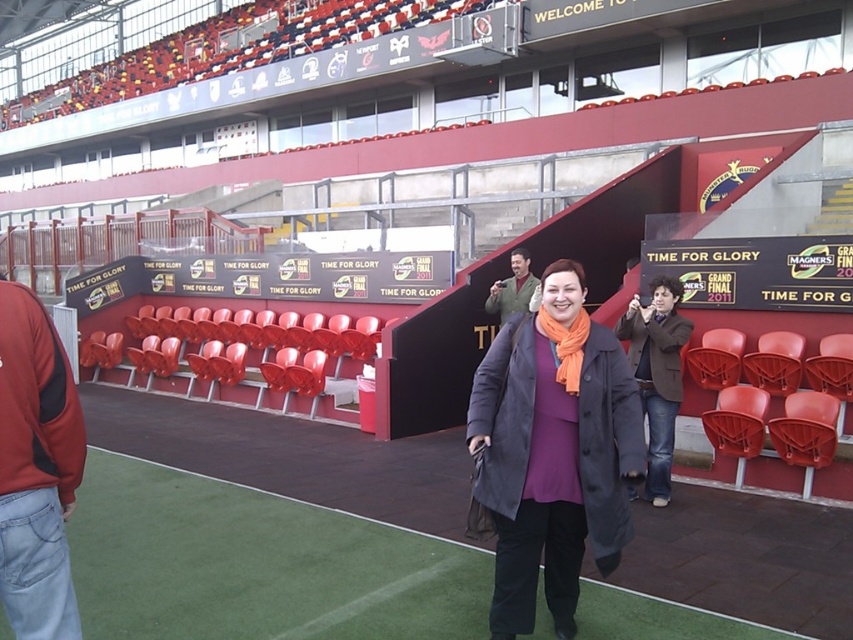
Is matte purple sweater at center to the right of green fuzzy jacket at center from the viewer's perspective?

No, matte purple sweater at center is not to the right of green fuzzy jacket at center.

This screenshot has height=640, width=853. What do you see at coordinates (553, 451) in the screenshot?
I see `matte purple sweater at center` at bounding box center [553, 451].

Who is more forward, (569, 536) or (512, 284)?

Point (569, 536)

Find the location of a particular element. Image resolution: width=853 pixels, height=640 pixels. matte purple sweater at center is located at coordinates (553, 451).

What do you see at coordinates (566, 346) in the screenshot?
I see `orange fabric scarf at center` at bounding box center [566, 346].

Does point (584, 310) lie behind point (521, 305)?

That is False.

Is point (578, 385) farther from camera compared to point (529, 298)?

No, it is not.

Find the location of a particular element. This screenshot has width=853, height=640. orange fabric scarf at center is located at coordinates (566, 346).

Is point (646, 337) in front of point (570, 385)?

No, (646, 337) is further to viewer.

Is brown leather jacket at center above orange fabric scarf at center?

No, brown leather jacket at center is not above orange fabric scarf at center.

The image size is (853, 640). In order to click on brown leather jacket at center in this screenshot , I will do `click(657, 372)`.